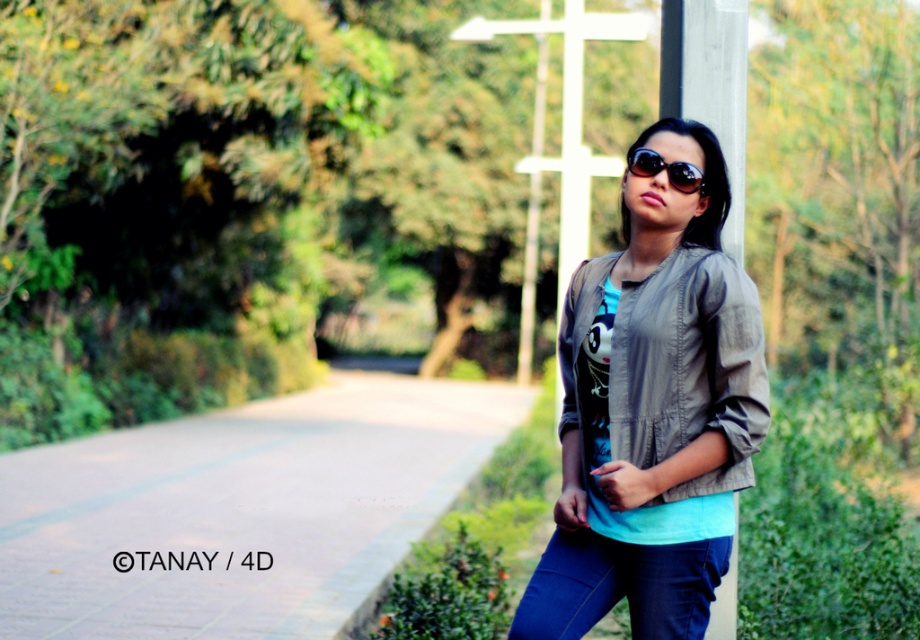
Question: Is matte gray jacket at center to the right of white wooden cross at center from the viewer's perspective?

Choices:
 (A) yes
 (B) no

Answer: (B)

Question: Based on their relative distances, which object is nearer to the sunglasses at center?

Choices:
 (A) gray wood pole at center
 (B) paved concrete at center
 (C) matte gray jacket at center

Answer: (C)

Question: Is gray wood pole at center below sunglasses at center?

Choices:
 (A) no
 (B) yes

Answer: (A)

Question: Does gray wood pole at center have a smaller size compared to sunglasses at center?

Choices:
 (A) yes
 (B) no

Answer: (B)

Question: Which point is farther to the camera?

Choices:
 (A) (740, 161)
 (B) (699, 170)
 (C) (679, 204)
 (D) (265, 438)

Answer: (D)

Question: Which of the following is the farthest from the observer?

Choices:
 (A) (530, 355)
 (B) (407, 416)

Answer: (A)